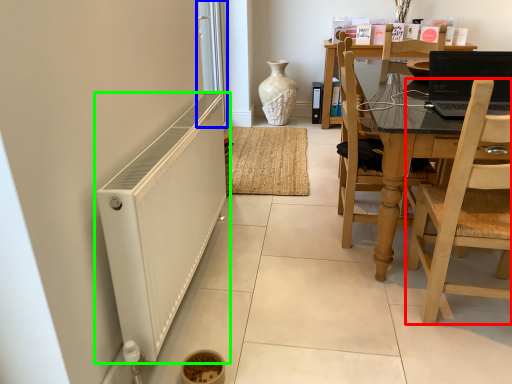
Question: Which object is positioned farthest from chair (highlighted by a red box)? Select from screen door (highlighted by a blue box) and radiator (highlighted by a green box).

Choices:
 (A) screen door
 (B) radiator

Answer: (A)